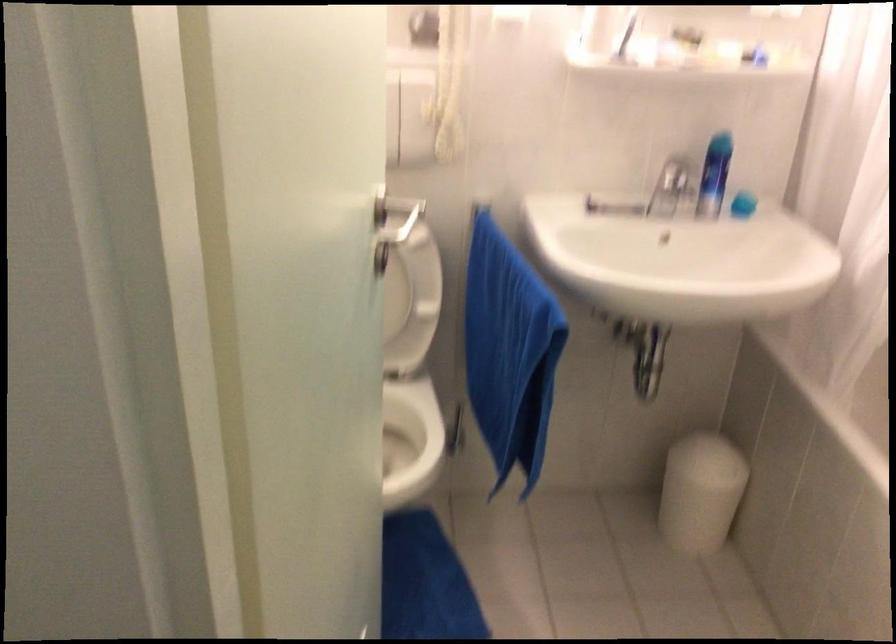
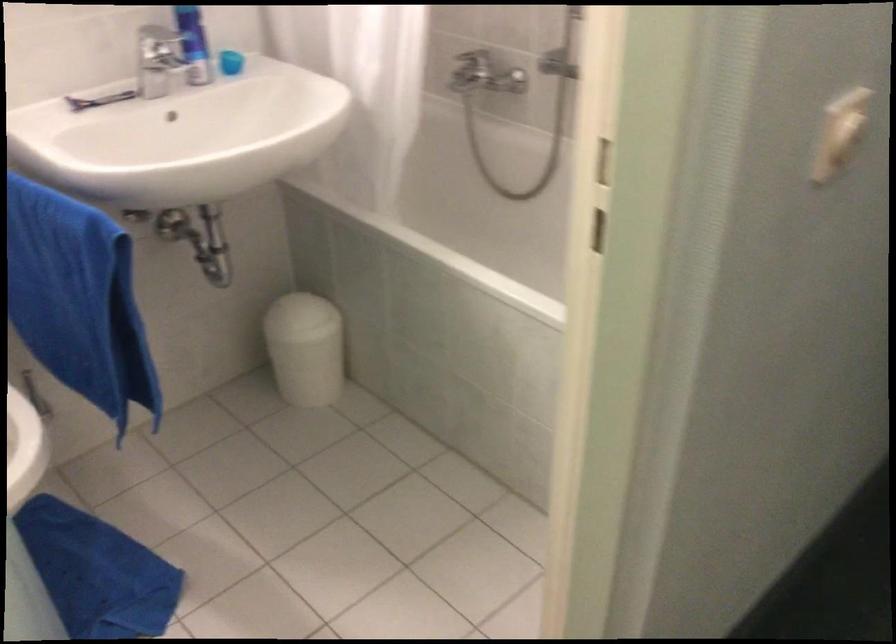
Find the pixel in the second image that matches pixel 704 447 in the first image.

(298, 310)